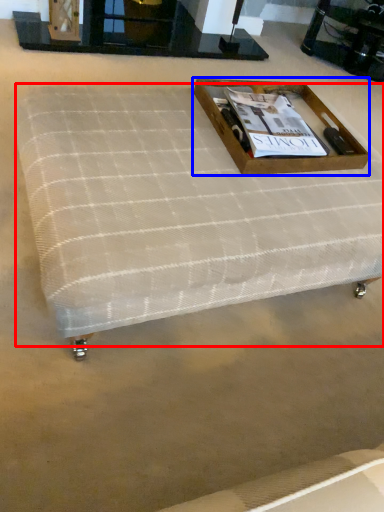
Question: Among these objects, which one is nearest to the camera, mattress (highlighted by a red box) or box (highlighted by a blue box)?

Choices:
 (A) mattress
 (B) box

Answer: (A)